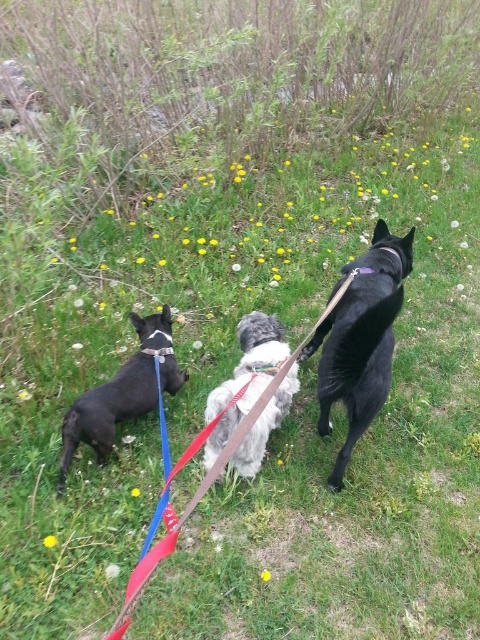
Question: Is shiny black dog at right thinner than shiny black dog at left?

Choices:
 (A) yes
 (B) no

Answer: (B)

Question: Does shiny black dog at left appear over brown leather leash at center?

Choices:
 (A) no
 (B) yes

Answer: (B)

Question: Which point is farther from the camera taking this photo?

Choices:
 (A) (175, 515)
 (B) (273, 376)

Answer: (B)

Question: Is shiny black dog at left further to camera compared to brown leather leash at center?

Choices:
 (A) yes
 (B) no

Answer: (A)

Question: Which object appears closest to the camera in this image?

Choices:
 (A) shiny black dog at right
 (B) brown leather leash at center

Answer: (B)

Question: Which point is closer to the camera taking this photo?

Choices:
 (A) (359, 392)
 (B) (212, 464)
 (C) (128, 388)
 (D) (328, 307)

Answer: (A)